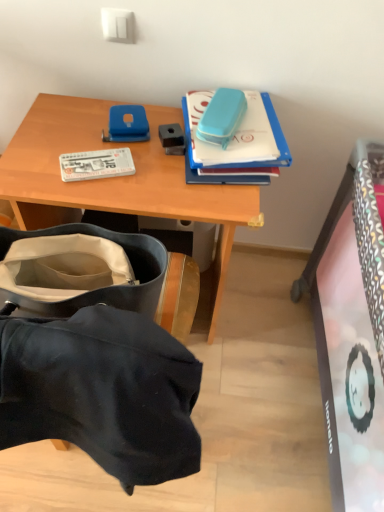
This screenshot has height=512, width=384. I want to click on vacant area to the left of blue matte case at upper right, arranged as the second book when viewed from the left, so click(128, 145).